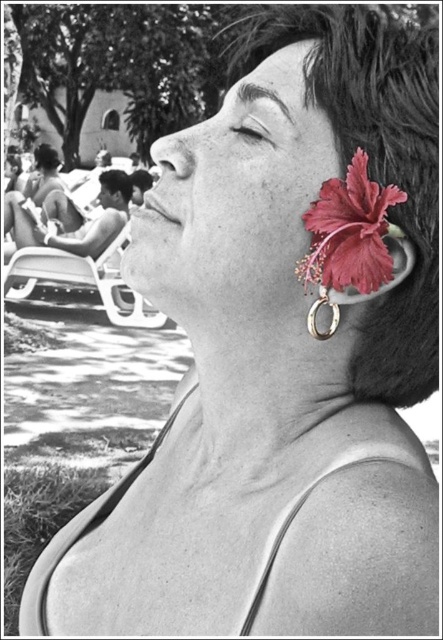
Which is above, matte skin nose at center or black matte hair at upper left?

black matte hair at upper left

Between matte skin nose at center and black matte hair at upper left, which one appears on the right side from the viewer's perspective?

matte skin nose at center is more to the right.

This screenshot has width=443, height=640. In order to click on matte skin nose at center in this screenshot , I will do `click(174, 154)`.

You are a GUI agent. You are given a task and a screenshot of the screen. Output one action in this format:
    pyautogui.click(x=<x>, y=<y>)
    Task: Click on the matte skin nose at center
    
    Given the screenshot: What is the action you would take?
    pyautogui.click(x=174, y=154)

Is matte black bikini top at upper left in front of matte black hair at upper left?

That is True.

Looking at this image, is matte black bikini top at upper left to the right of matte black hair at upper left from the viewer's perspective?

Yes, matte black bikini top at upper left is to the right of matte black hair at upper left.

Locate an element on the screen. matte black bikini top at upper left is located at coordinates (78, 227).

Who is taller, matte red flower at ear or matte black eye at upper center?

With more height is matte red flower at ear.

Does matte red flower at ear have a larger size compared to matte black eye at upper center?

Yes, matte red flower at ear is bigger than matte black eye at upper center.

Who is more forward, (x=352, y=176) or (x=252, y=125)?

Point (x=352, y=176)

Image resolution: width=443 pixels, height=640 pixels. Find the location of `matte red flower at ear`. matte red flower at ear is located at coordinates (349, 232).